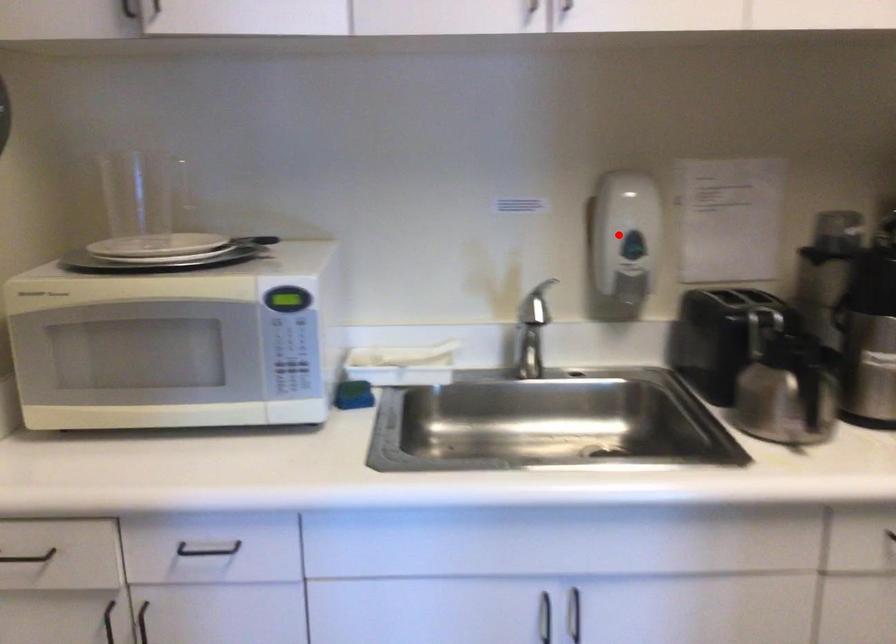
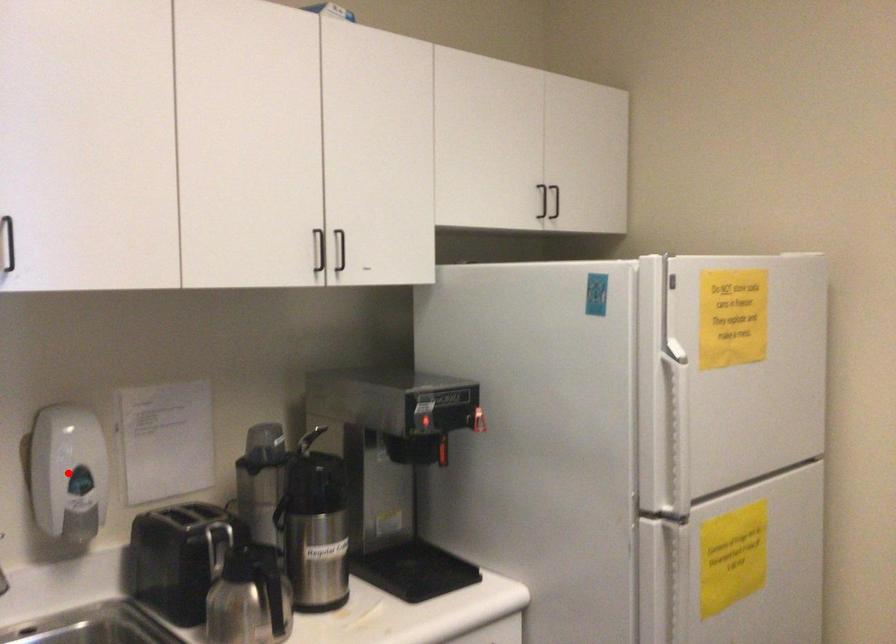
I am providing you with two images of the same scene from different viewpoints. A red point is marked on the first image and another point is marked on the second image. Are the points marked in image1 and image2 representing the same 3D position?

Yes